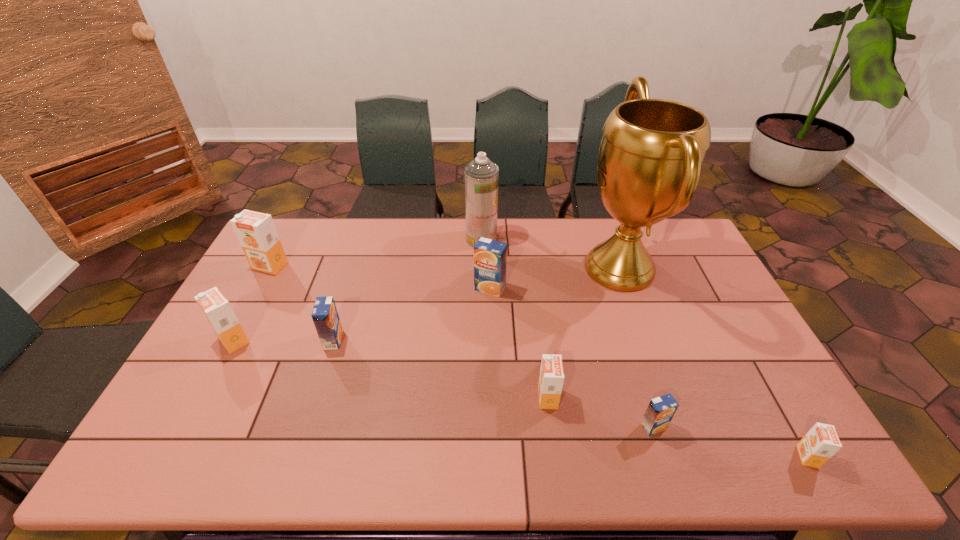
Where is `vacant space positioned on the back of the farthest orange orange juice`? vacant space positioned on the back of the farthest orange orange juice is located at coordinates [293, 223].

This screenshot has width=960, height=540. I want to click on free space located 0.130m on the back of the farthest blue orange_juice, so click(489, 255).

Locate an element on the screen. The height and width of the screenshot is (540, 960). vacant position located 0.280m on the front of the third nearest orange orange juice is located at coordinates (177, 448).

Image resolution: width=960 pixels, height=540 pixels. In order to click on vacant space located 0.320m on the front of the leftmost blue orange_juice in this screenshot , I will do `click(296, 458)`.

Identify the location of blank space located on the right of the sixth object from left to right. coord(622,397).

At what (x,y) coordinates should I click in order to perform the action: click on free point located 0.260m on the left of the rightmost blue orange_juice. Please return your answer as a coordinate pair (x, y). The image size is (960, 540). Looking at the image, I should click on (536, 427).

I want to click on vacant space situated 0.070m on the back of the nearest object, so [x=785, y=418].

Image resolution: width=960 pixels, height=540 pixels. In order to click on trophy cup at the far edge in this screenshot , I will do `click(652, 150)`.

The image size is (960, 540). Find the location of `aerosol can located at the far edge`. aerosol can located at the far edge is located at coordinates (481, 176).

At what (x,y) coordinates should I click in order to perform the action: click on object that is at the right edge. Please return your answer as a coordinate pair (x, y). The width and height of the screenshot is (960, 540). Looking at the image, I should click on (821, 442).